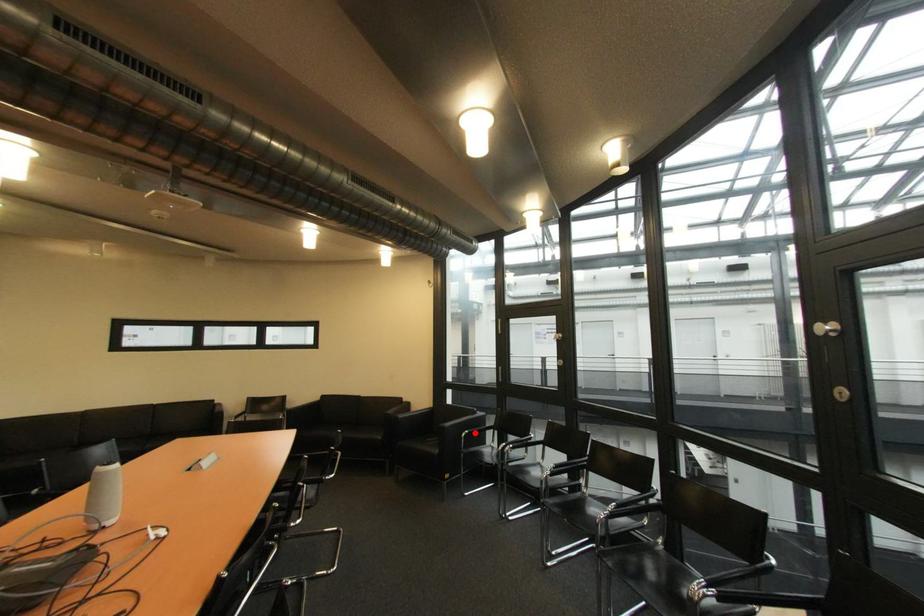
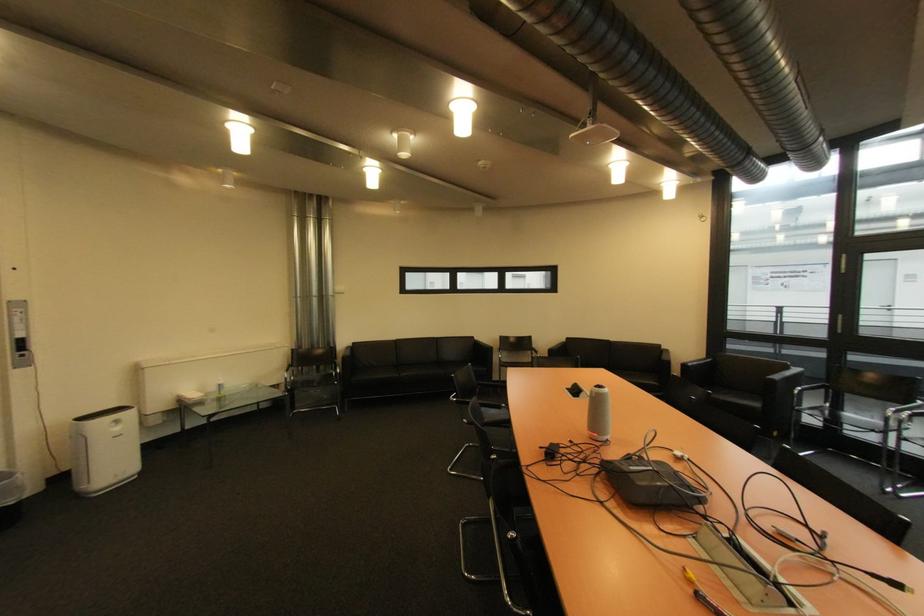
Locate, in the second image, the point that corresponds to the highlighted location in the first image.

(808, 390)